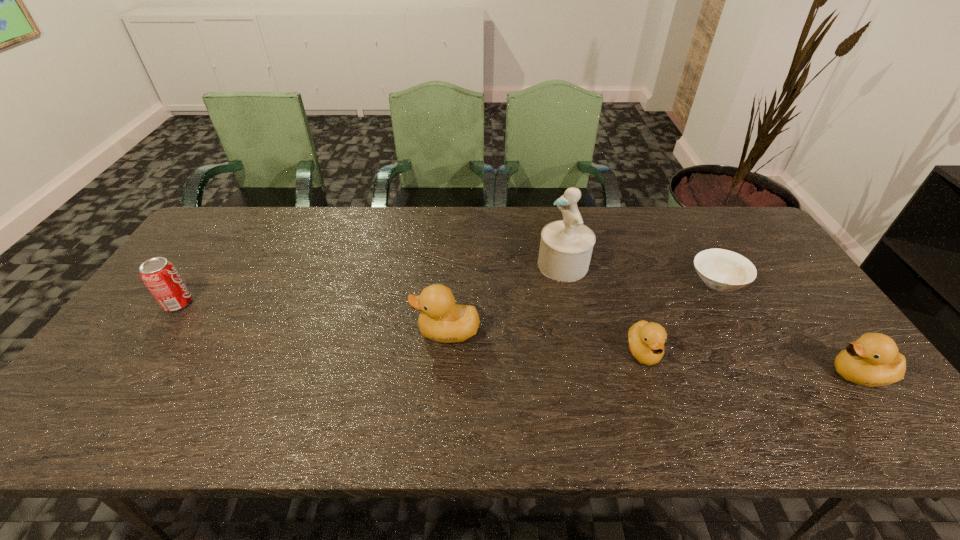
Image resolution: width=960 pixels, height=540 pixels. Identify the location of free space for a new duckling on the left. (266, 313).